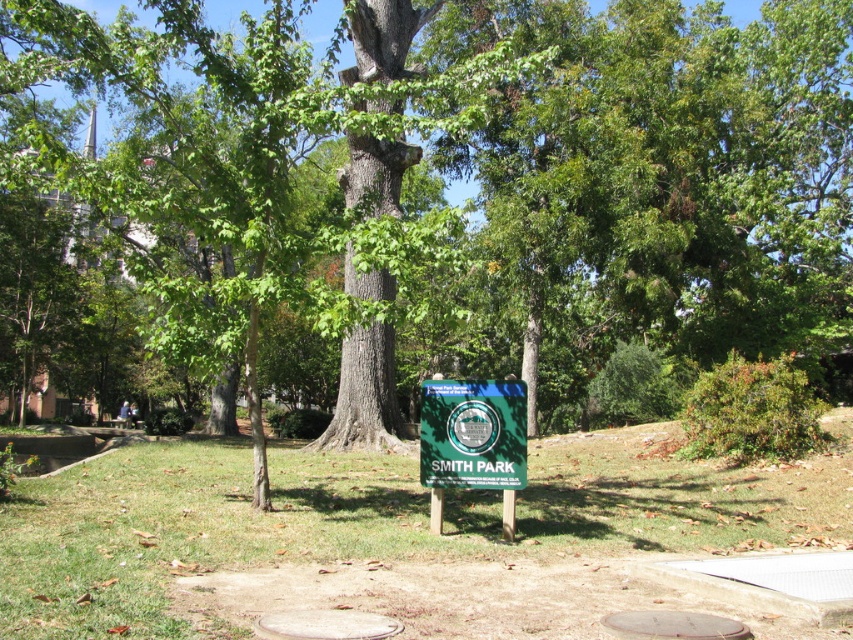
Question: Which point is closer to the camera?

Choices:
 (A) (425, 380)
 (B) (193, 477)

Answer: (A)

Question: From the image, what is the correct spatial relationship of green grass at center in relation to green plastic sign at center?

Choices:
 (A) right
 (B) left

Answer: (B)

Question: Is green grass at center to the right of green plastic sign at center from the viewer's perspective?

Choices:
 (A) no
 (B) yes

Answer: (A)

Question: Can you confirm if green grass at center is smaller than green plastic sign at center?

Choices:
 (A) no
 (B) yes

Answer: (A)